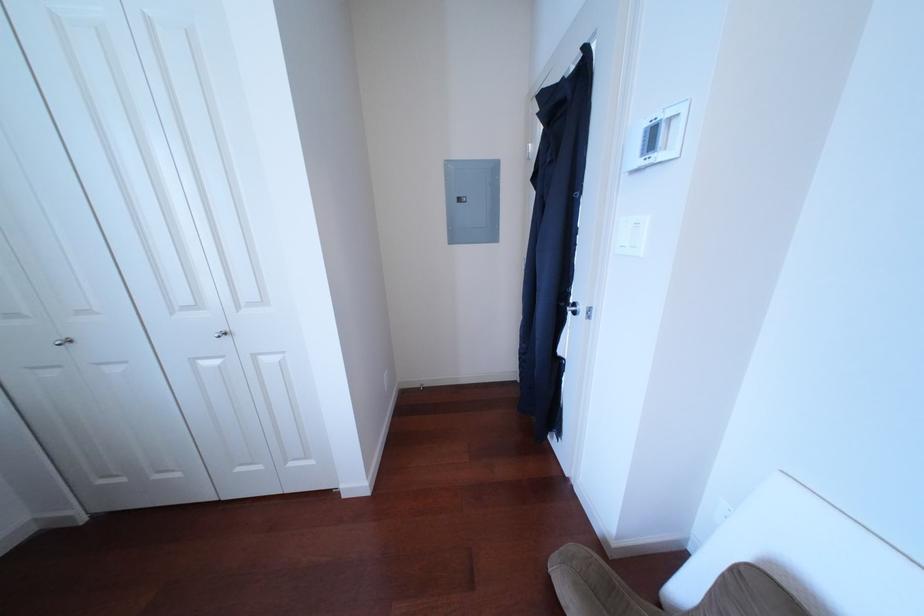
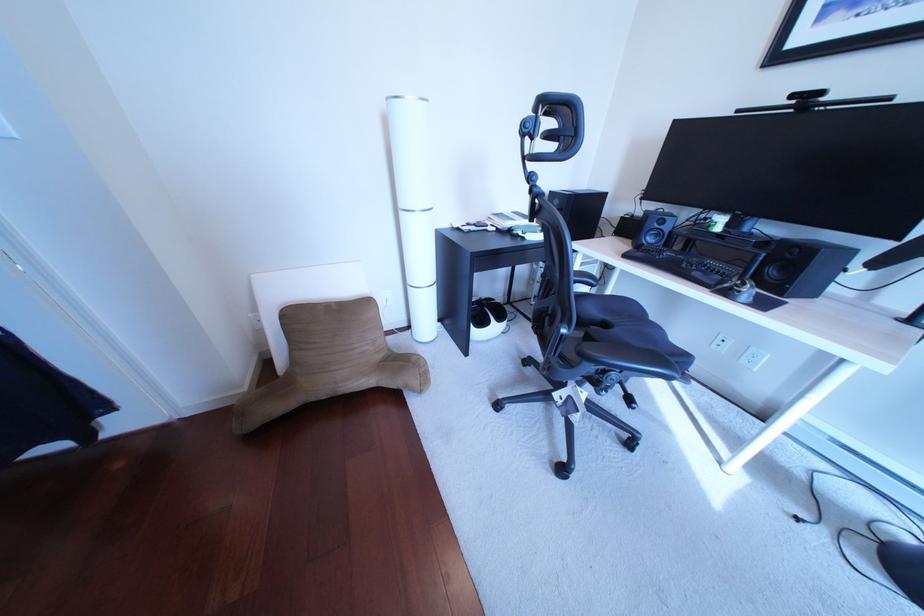
How did the camera likely rotate?

The camera's rotation is toward right-down.